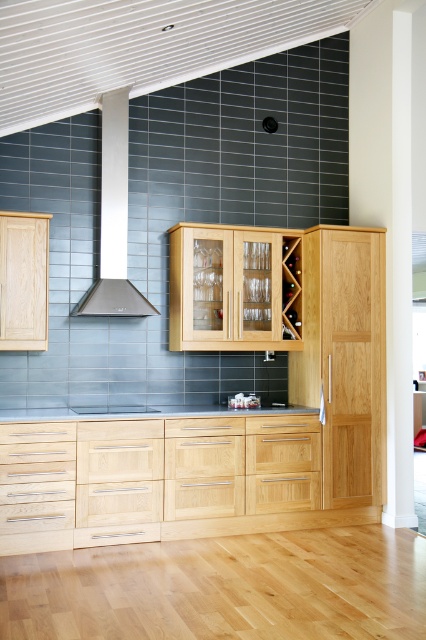
Can you confirm if wooden cabinet at center is smaller than natural wood cabinet at left?

Incorrect, wooden cabinet at center is not smaller in size than natural wood cabinet at left.

Between wooden cabinet at center and natural wood cabinet at left, which one is positioned lower?

wooden cabinet at center

The image size is (426, 640). What are the coordinates of `wooden cabinet at center` in the screenshot? It's located at point(233,289).

Does natural wood cabinet at left appear over black laminate countertop at center?

Yes.

This screenshot has height=640, width=426. What do you see at coordinates (23, 280) in the screenshot? I see `natural wood cabinet at left` at bounding box center [23, 280].

This screenshot has width=426, height=640. Identify the location of natural wood cabinet at left. (23, 280).

I want to click on natural wood cabinet at left, so click(x=23, y=280).

Does natural wood cabinet at left have a greater height compared to matte wood countertop at center?

Yes, natural wood cabinet at left is taller than matte wood countertop at center.

Is point (46, 344) positioned in front of point (129, 412)?

Yes.

Where is `natural wood cabinet at left`? Image resolution: width=426 pixels, height=640 pixels. natural wood cabinet at left is located at coordinates (23, 280).

Find the location of `natural wood cabinet at left`. natural wood cabinet at left is located at coordinates (23, 280).